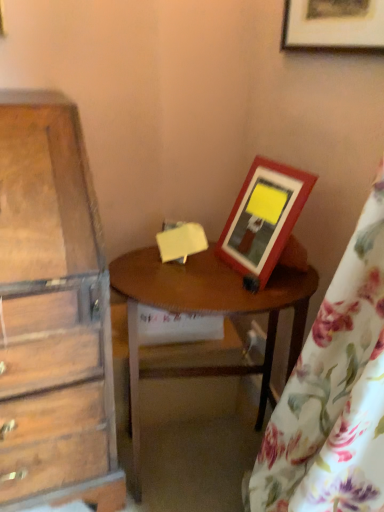
Question: Can you confirm if wooden picture frame at upper right, marked as the 1th picture frame in a bottom-to-top arrangement, is wider than floral fabric curtain at right?

Choices:
 (A) yes
 (B) no

Answer: (B)

Question: Can you confirm if wooden picture frame at upper right, marked as the 1th picture frame in a bottom-to-top arrangement, is shorter than floral fabric curtain at right?

Choices:
 (A) no
 (B) yes

Answer: (B)

Question: From a real-world perspective, is wooden picture frame at upper right, marked as the 1th picture frame in a bottom-to-top arrangement, positioned over floral fabric curtain at right based on gravity?

Choices:
 (A) no
 (B) yes

Answer: (B)

Question: Would you say wooden picture frame at upper right, acting as the second picture frame starting from the top, is outside floral fabric curtain at right?

Choices:
 (A) yes
 (B) no

Answer: (A)

Question: Is wooden picture frame at upper right, marked as the 1th picture frame in a bottom-to-top arrangement, to the right of floral fabric curtain at right from the viewer's perspective?

Choices:
 (A) yes
 (B) no

Answer: (B)

Question: Is wooden table at center wider or thinner than floral fabric curtain at right?

Choices:
 (A) wide
 (B) thin

Answer: (B)

Question: Is wooden table at center in front of or behind floral fabric curtain at right in the image?

Choices:
 (A) front
 (B) behind

Answer: (B)

Question: Does point (140, 279) appear closer or farther from the camera than point (279, 480)?

Choices:
 (A) farther
 (B) closer

Answer: (B)

Question: Would you say wooden table at center is to the left or to the right of floral fabric curtain at right in the picture?

Choices:
 (A) right
 (B) left

Answer: (B)

Question: Does point (357, 365) appear closer or farther from the camera than point (375, 4)?

Choices:
 (A) farther
 (B) closer

Answer: (B)

Question: Visually, is floral fabric curtain at right positioned to the left or to the right of wooden picture frame at upper right, the first picture frame positioned from the top?

Choices:
 (A) left
 (B) right

Answer: (B)

Question: From the image's perspective, relative to wooden picture frame at upper right, the first picture frame positioned from the top, is floral fabric curtain at right above or below?

Choices:
 (A) below
 (B) above

Answer: (A)

Question: From a real-world perspective, is floral fabric curtain at right physically located above or below wooden picture frame at upper right, the first picture frame positioned from the top?

Choices:
 (A) below
 (B) above

Answer: (A)

Question: From a real-world perspective, is wooden picture frame at upper right, marked as the 1th picture frame in a bottom-to-top arrangement, above or below wooden table at center?

Choices:
 (A) below
 (B) above

Answer: (B)

Question: From the image's perspective, is wooden picture frame at upper right, marked as the 1th picture frame in a bottom-to-top arrangement, positioned above or below wooden table at center?

Choices:
 (A) above
 (B) below

Answer: (A)